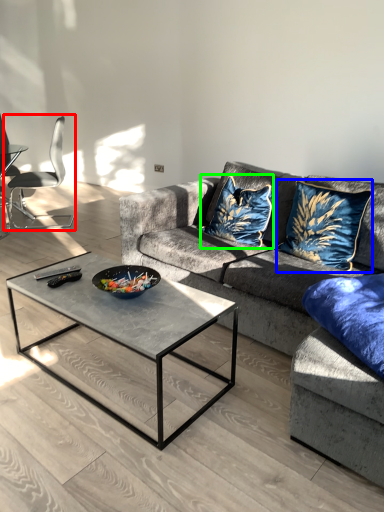
Question: Based on their relative distances, which object is nearer to chair (highlighted by a red box)? Choose from throw pillow (highlighted by a blue box) and throw pillow (highlighted by a green box).

Choices:
 (A) throw pillow
 (B) throw pillow

Answer: (B)